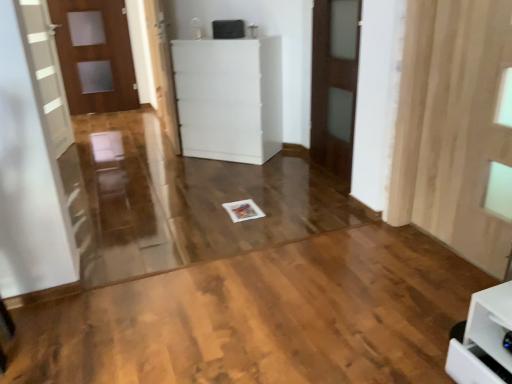
Question: Considering the positions of matte wooden door at left, marked as the 1th door in a left-to-right arrangement, and white glossy door at center, which is the 2th door in front-to-back order, in the image, is matte wooden door at left, marked as the 1th door in a left-to-right arrangement, wider or thinner than white glossy door at center, which is the 2th door in front-to-back order,?

Choices:
 (A) thin
 (B) wide

Answer: (A)

Question: In terms of height, does matte wooden door at left, marked as the 1th door in a left-to-right arrangement, look taller or shorter compared to white glossy door at center, positioned as the second door in right-to-left order?

Choices:
 (A) short
 (B) tall

Answer: (B)

Question: Based on their relative distances, which object is farther from the white plastic cabinet at center?

Choices:
 (A) black plastic speaker at upper center
 (B) matte wooden door at left, the first door viewed from the back
 (C) brown wooden door at center, the first door viewed from the front
 (D) wooden curtain at right
 (E) natural wood floor at center

Answer: (B)

Question: Which object is the closest to the natural wood floor at center?

Choices:
 (A) white plastic cabinet at center
 (B) brown wooden door at center, which is counted as the 3th door, starting from the back
 (C) white glossy door at center, the second door from the left
 (D) wooden curtain at right
 (E) matte wooden door at left, marked as the 1th door in a left-to-right arrangement

Answer: (D)